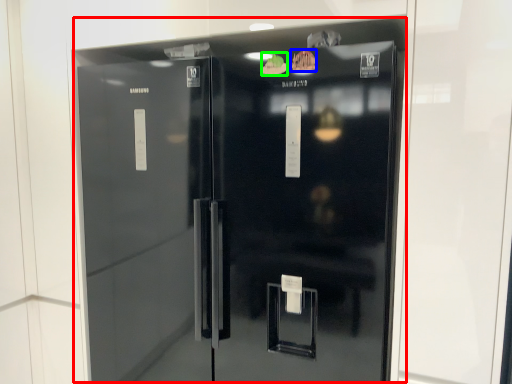
Question: Considering the real-world distances, which object is farthest from refrigerator (highlighted by a red box)? food (highlighted by a blue box) or food (highlighted by a green box)?

Choices:
 (A) food
 (B) food

Answer: (A)